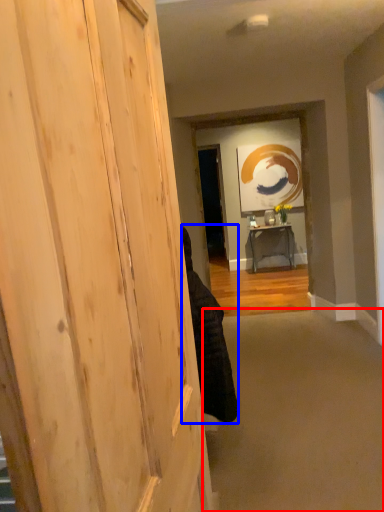
Question: Which point is closer to the camera, plain (highlighted by a red box) or person (highlighted by a blue box)?

Choices:
 (A) plain
 (B) person

Answer: (A)